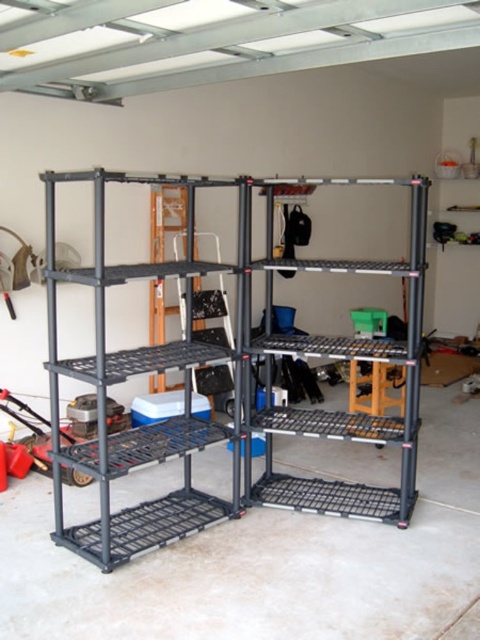
Can you confirm if black metal shelf at center is taller than black wire shelving unit at center?

Correct, black metal shelf at center is much taller as black wire shelving unit at center.

Is black metal shelf at center above black wire shelving unit at center?

Actually, black metal shelf at center is below black wire shelving unit at center.

Locate an element on the screen. black metal shelf at center is located at coordinates (126, 380).